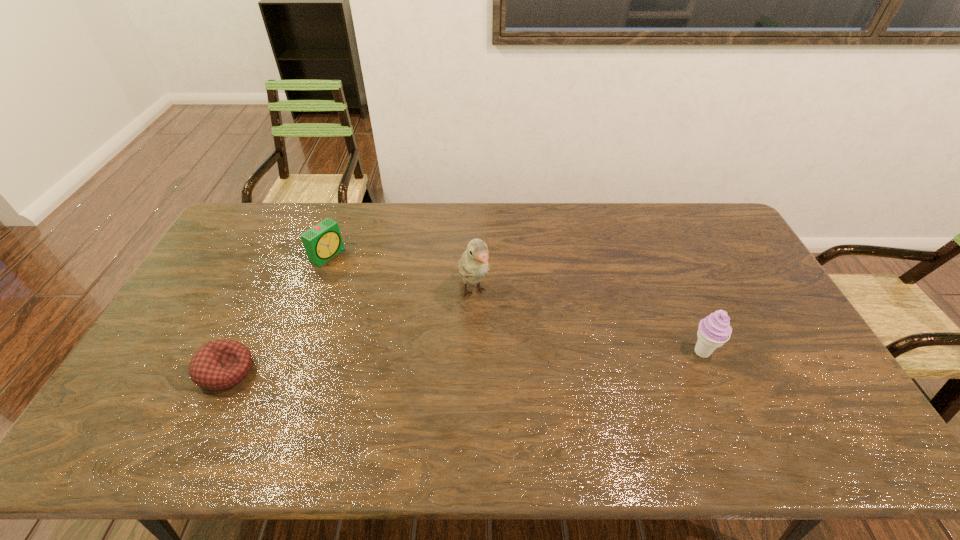
Locate an element on the screen. beanbag is located at coordinates (220, 364).

The width and height of the screenshot is (960, 540). What are the coordinates of `the leftmost object` in the screenshot? It's located at (220, 364).

This screenshot has width=960, height=540. I want to click on icecream, so click(x=714, y=330).

The height and width of the screenshot is (540, 960). In order to click on the rightmost object in this screenshot , I will do `click(714, 330)`.

I want to click on the second object from right to left, so click(x=473, y=265).

At what (x,y) coordinates should I click in order to perform the action: click on bird. Please return your answer as a coordinate pair (x, y). Looking at the image, I should click on (473, 265).

Identify the location of the second object from left to right. (323, 241).

Image resolution: width=960 pixels, height=540 pixels. I want to click on the farthest object, so click(323, 241).

Image resolution: width=960 pixels, height=540 pixels. I want to click on vacant point located on the back of the shortest object, so click(x=248, y=327).

I want to click on vacant space positioned on the front of the icecream, so click(x=721, y=397).